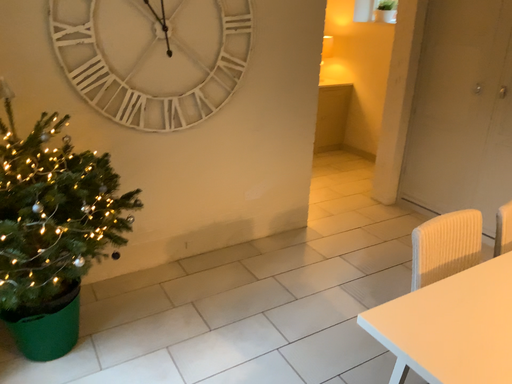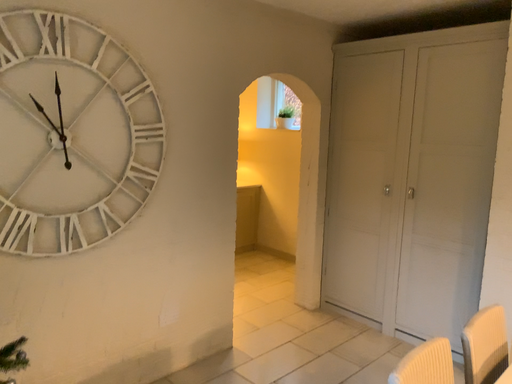
Question: How did the camera likely rotate when shooting the video?

Choices:
 (A) rotated upward
 (B) rotated downward

Answer: (A)